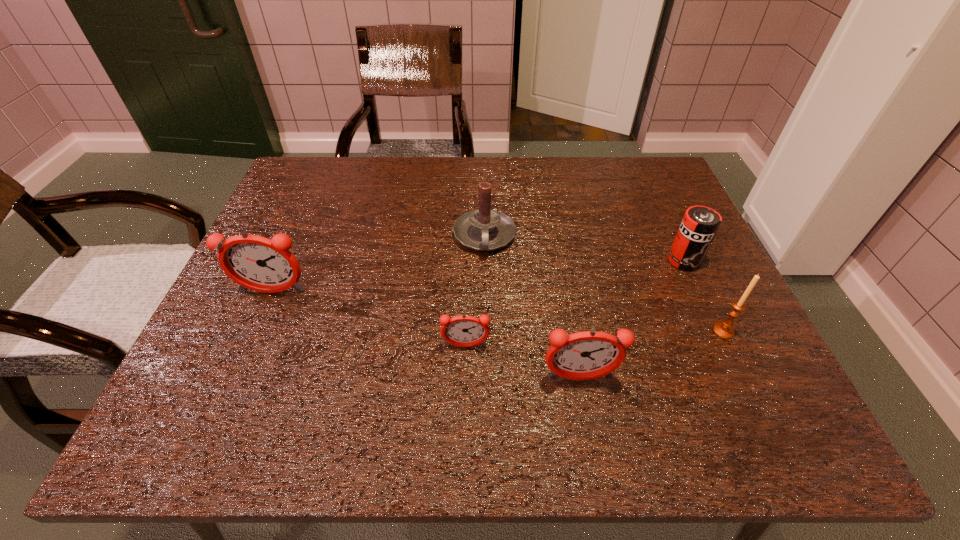
This screenshot has height=540, width=960. I want to click on blank space at the left edge of the desktop, so point(231,293).

Locate an element on the screen. vacant space at the right edge is located at coordinates (703, 278).

Where is `vacant space at the far left corner of the desktop`? The image size is (960, 540). vacant space at the far left corner of the desktop is located at coordinates (303, 163).

The image size is (960, 540). Find the location of `vacant region at the near left corner of the desktop`. vacant region at the near left corner of the desktop is located at coordinates (229, 368).

I want to click on vacant space at the far right corner of the desktop, so click(x=634, y=177).

At what (x,y) coordinates should I click in order to perform the action: click on vacant area between the candle_holder and the candle. Please return your answer as a coordinate pair (x, y). Looking at the image, I should click on (604, 284).

Locate an element on the screen. Image resolution: width=960 pixels, height=540 pixels. free point between the leftmost alarm clock and the can is located at coordinates (478, 276).

The image size is (960, 540). Find the location of `unoccupied position between the fourth farthest object and the fourth nearest object`. unoccupied position between the fourth farthest object and the fourth nearest object is located at coordinates (498, 312).

You are a GUI agent. You are given a task and a screenshot of the screen. Output one action in this format:
    pyautogui.click(x=<x>, y=<y>)
    Task: Click on the free space between the rightmost alarm clock and the fifth farthest object
    
    Given the screenshot: What is the action you would take?
    pyautogui.click(x=522, y=362)

What are the coordinates of `free spot between the candle_holder and the third farthest object` in the screenshot? It's located at (498, 312).